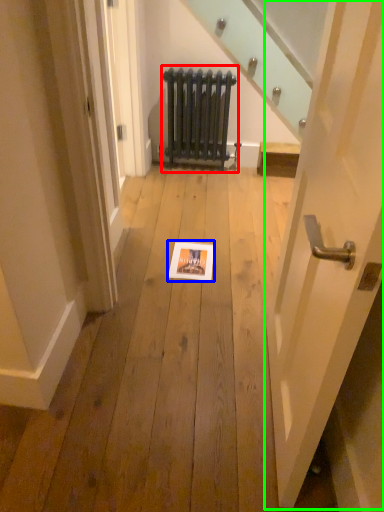
Question: Which is nearer to the radiator (highlighted by a red box)? picture frame (highlighted by a blue box) or door (highlighted by a green box).

Choices:
 (A) picture frame
 (B) door

Answer: (A)